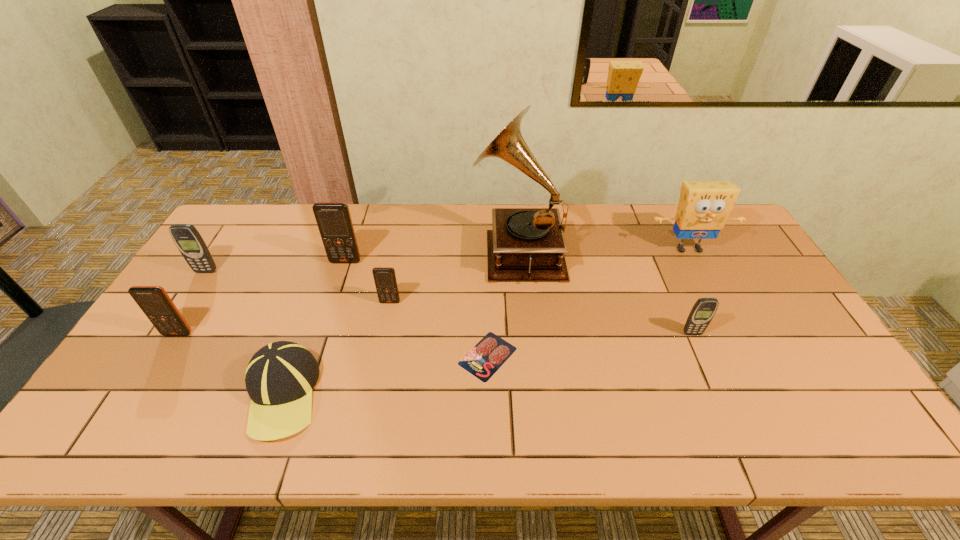
What are the coordinates of `the tallest object` in the screenshot? It's located at [526, 244].

The height and width of the screenshot is (540, 960). Identify the location of record player. (526, 244).

This screenshot has width=960, height=540. What are the coordinates of `sponge` in the screenshot? It's located at (703, 208).

You are a GUI agent. You are given a task and a screenshot of the screen. Output one action in this format:
    pyautogui.click(x=<x>, y=<y>)
    Task: Click on the farthest orange cellular telephone
    This screenshot has width=960, height=540.
    Given the screenshot: What is the action you would take?
    click(334, 221)

At what (x,y) coordinates should I click in order to perform the action: click on the biggest orange cellular telephone. Please return your answer as a coordinate pair (x, y). The height and width of the screenshot is (540, 960). Looking at the image, I should click on (334, 221).

Find the location of `the left gray cellular telephone`. the left gray cellular telephone is located at coordinates (188, 240).

The image size is (960, 540). I want to click on the second farthest cellular telephone, so click(188, 240).

You are a GUI agent. You are given a task and a screenshot of the screen. Output one action in this format:
    pyautogui.click(x=<x>, y=<y>)
    Task: Click on the leftmost orange cellular telephone
    Image resolution: width=960 pixels, height=540 pixels.
    Given the screenshot: What is the action you would take?
    pyautogui.click(x=153, y=300)

What are the coordinates of `the second smallest orange cellular telephone` in the screenshot? It's located at (153, 300).

At what (x,y) coordinates should I click in order to perform the action: click on the rightmost orange cellular telephone. Please return your answer as a coordinate pair (x, y). The width and height of the screenshot is (960, 540). Looking at the image, I should click on (385, 280).